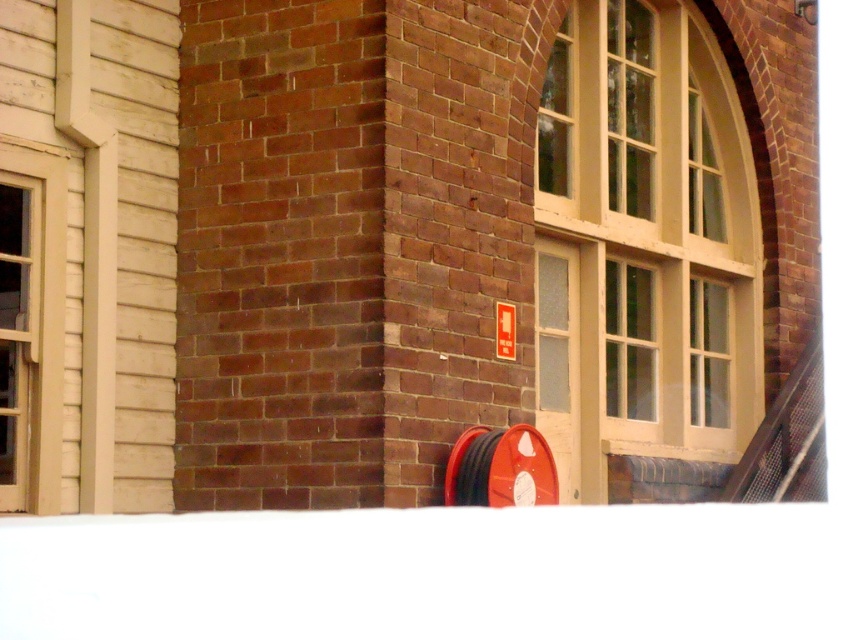
Can you confirm if metal mesh rail at lower right is positioned to the right of red plastic sign at center?

Indeed, metal mesh rail at lower right is positioned on the right side of red plastic sign at center.

Does metal mesh rail at lower right come in front of red plastic sign at center?

No, metal mesh rail at lower right is further to the viewer.

Looking at this image, who is more forward, (x=813, y=426) or (x=502, y=317)?

Point (x=502, y=317)

What are the coordinates of `metal mesh rail at lower right` in the screenshot? It's located at (786, 440).

Who is shorter, matte cream window at center or matte beige window at left?

matte beige window at left is shorter.

Is point (676, 179) positioned before point (10, 352)?

No, (676, 179) is behind (10, 352).

The height and width of the screenshot is (640, 853). In order to click on matte cream window at center in this screenshot , I will do `click(643, 243)`.

Does matte cream window at center appear under red plastic sign at center?

No, matte cream window at center is not below red plastic sign at center.

Who is more forward, (567, 362) or (498, 316)?

Point (498, 316) is in front.

You are a GUI agent. You are given a task and a screenshot of the screen. Output one action in this format:
    pyautogui.click(x=<x>, y=<y>)
    Task: Click on the matte cream window at center
    
    Given the screenshot: What is the action you would take?
    pyautogui.click(x=643, y=243)